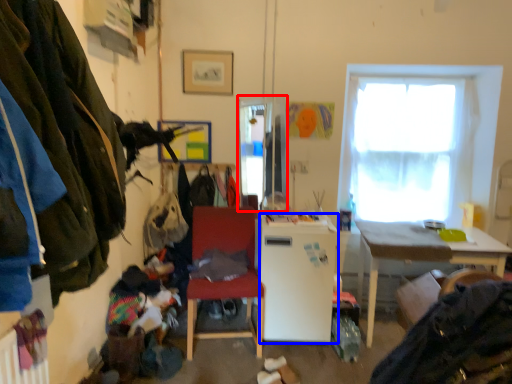
Question: Which object appears farthest to the camera in this image, window screen (highlighted by a red box) or refrigerator (highlighted by a blue box)?

Choices:
 (A) window screen
 (B) refrigerator

Answer: (A)